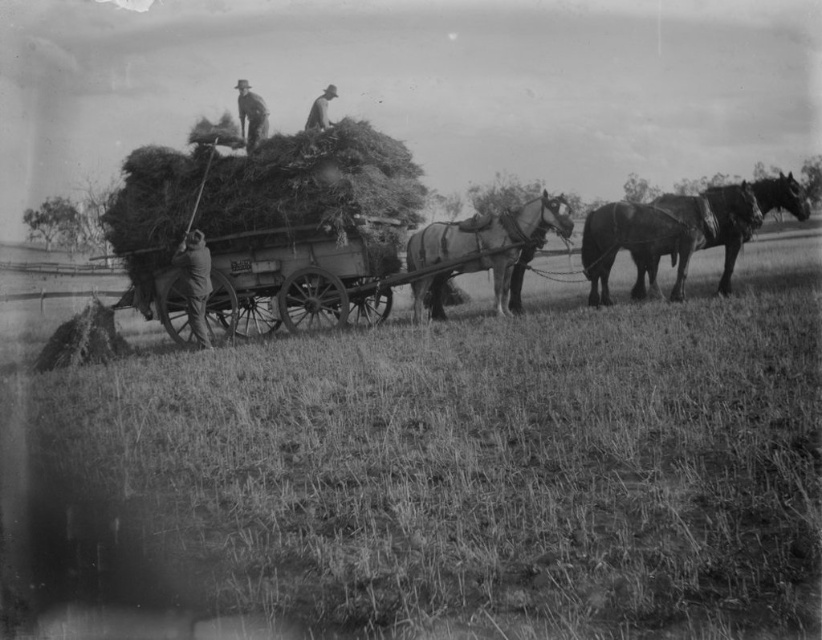
Where is the smooth brown horse at center located in the image?

The smooth brown horse at center is located at point (x=483, y=248).

You are a farmer who needs to secure your leather jacket before hitching up the horses. Based on the scene, where should you place the dark brown leather jacket at lower left relative to the smooth brown horse at center?

The smooth brown horse at center is in front of the dark brown leather jacket at lower left, so you should place the dark brown leather jacket at lower left behind the smooth brown horse at center.